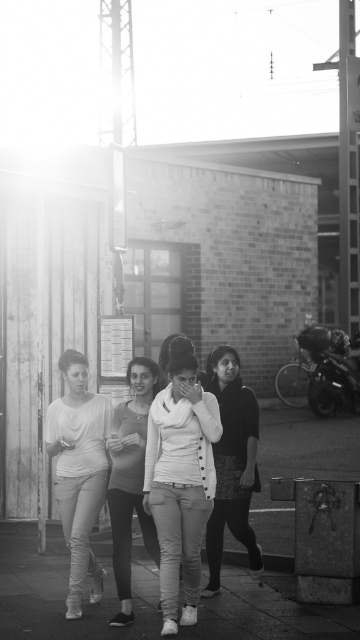
Question: Estimate the real-world distances between objects in this image. Which object is closer to the matte white sweater at center?

Choices:
 (A) smooth concrete pavement at lower center
 (B) white textured sweater at center
 (C) white cotton sweater at center

Answer: (C)

Question: Which of the following is the farthest from the observer?

Choices:
 (A) smooth concrete pavement at lower center
 (B) white cotton sweater at center
 (C) white textured sweater at center

Answer: (C)

Question: Is white cotton sweater at center above matte white sweater at center?

Choices:
 (A) no
 (B) yes

Answer: (B)

Question: Is the position of white cotton sweater at center less distant than that of matte white sweater at center?

Choices:
 (A) no
 (B) yes

Answer: (B)

Question: Does matte white blouse at center have a larger size compared to white textured sweater at center?

Choices:
 (A) no
 (B) yes

Answer: (B)

Question: Which of the following is the closest to the observer?

Choices:
 (A) smooth concrete pavement at lower center
 (B) matte white blouse at center
 (C) white textured sweater at center
 (D) white cotton sweater at center

Answer: (A)